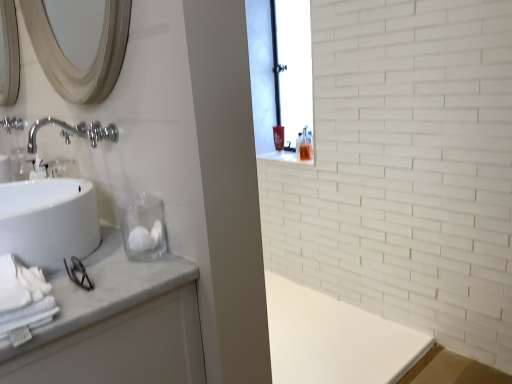
Question: Is the position of chrome metallic faucet at upper left, which ranks as the 1th plumbing fixture in top-to-bottom order, less distant than that of white glossy sink at left?

Choices:
 (A) yes
 (B) no

Answer: (B)

Question: Is chrome metallic faucet at upper left, placed as the 2th plumbing fixture when sorted from bottom to top, to the left of white glossy sink at left from the viewer's perspective?

Choices:
 (A) no
 (B) yes

Answer: (B)

Question: Is chrome metallic faucet at upper left, the second plumbing fixture in the right-to-left sequence, at the right side of white glossy sink at left?

Choices:
 (A) yes
 (B) no

Answer: (B)

Question: From the image's perspective, is chrome metallic faucet at upper left, the second plumbing fixture positioned from the front, above white glossy sink at left?

Choices:
 (A) yes
 (B) no

Answer: (A)

Question: In the image, is polished chrome faucet at upper left, which appears as the first plumbing fixture when viewed from the front, positioned in front of or behind white glossy sink at left?

Choices:
 (A) front
 (B) behind

Answer: (B)

Question: From a real-world perspective, is polished chrome faucet at upper left, placed as the second plumbing fixture when sorted from back to front, above or below white glossy sink at left?

Choices:
 (A) above
 (B) below

Answer: (A)

Question: Considering the positions of polished chrome faucet at upper left, which appears as the first plumbing fixture when viewed from the front, and white glossy sink at left in the image, is polished chrome faucet at upper left, which appears as the first plumbing fixture when viewed from the front, wider or thinner than white glossy sink at left?

Choices:
 (A) wide
 (B) thin

Answer: (B)

Question: From their relative heights in the image, would you say polished chrome faucet at upper left, the 2th plumbing fixture viewed from the top, is taller or shorter than white glossy sink at left?

Choices:
 (A) tall
 (B) short

Answer: (B)

Question: Considering their positions, is white glossy sink at left located in front of or behind white cotton bath towel at lower left?

Choices:
 (A) behind
 (B) front

Answer: (A)

Question: From the image's perspective, is white glossy sink at left located above or below white cotton bath towel at lower left?

Choices:
 (A) above
 (B) below

Answer: (A)

Question: Is white glossy sink at left taller or shorter than white cotton bath towel at lower left?

Choices:
 (A) tall
 (B) short

Answer: (A)

Question: Considering the relative positions of white glossy sink at left and white cotton bath towel at lower left in the image provided, is white glossy sink at left to the left or to the right of white cotton bath towel at lower left?

Choices:
 (A) right
 (B) left

Answer: (B)

Question: Visually, is white cotton bath towel at lower left positioned to the left or to the right of white marble bathroom cabinet at left?

Choices:
 (A) left
 (B) right

Answer: (B)

Question: From the image's perspective, is white cotton bath towel at lower left positioned above or below white marble bathroom cabinet at left?

Choices:
 (A) above
 (B) below

Answer: (A)